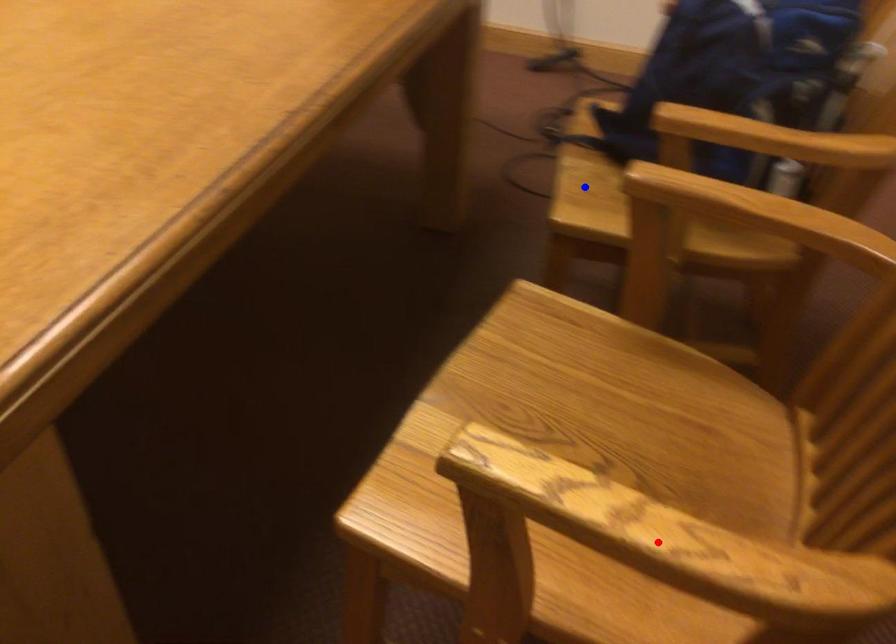
Question: Which of the two points in the image is closer to the camera?

Choices:
 (A) Blue point is closer.
 (B) Red point is closer.

Answer: (B)